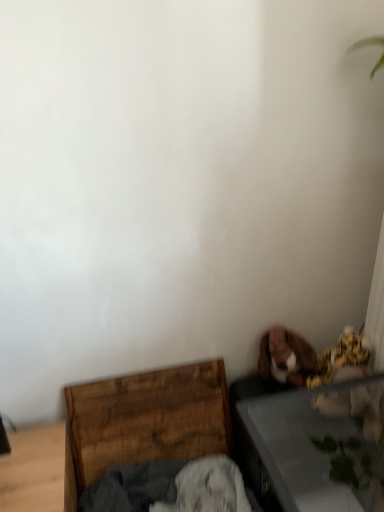
Question: Is dark gray cotton cloth at lower center with transparent glass table at lower right?

Choices:
 (A) no
 (B) yes

Answer: (A)

Question: Can you confirm if dark gray cotton cloth at lower center is smaller than transparent glass table at lower right?

Choices:
 (A) no
 (B) yes

Answer: (B)

Question: Would you say dark gray cotton cloth at lower center is outside transparent glass table at lower right?

Choices:
 (A) no
 (B) yes

Answer: (B)

Question: Are dark gray cotton cloth at lower center and transparent glass table at lower right located far from each other?

Choices:
 (A) yes
 (B) no

Answer: (B)

Question: From a real-world perspective, is dark gray cotton cloth at lower center on top of transparent glass table at lower right?

Choices:
 (A) yes
 (B) no

Answer: (B)

Question: From their relative heights in the image, would you say brown plush dog at lower right is taller or shorter than dark gray cotton cloth at lower center?

Choices:
 (A) tall
 (B) short

Answer: (A)

Question: Based on their positions, is brown plush dog at lower right located to the left or right of dark gray cotton cloth at lower center?

Choices:
 (A) right
 (B) left

Answer: (A)

Question: Does point (286, 381) appear closer or farther from the camera than point (216, 457)?

Choices:
 (A) closer
 (B) farther

Answer: (A)

Question: Is brown plush dog at lower right bigger or smaller than dark gray cotton cloth at lower center?

Choices:
 (A) small
 (B) big

Answer: (A)

Question: From a real-world perspective, relative to dark gray cotton cloth at lower center, is wooden chest at lower left vertically above or below?

Choices:
 (A) above
 (B) below

Answer: (A)

Question: From the image's perspective, is wooden chest at lower left above or below dark gray cotton cloth at lower center?

Choices:
 (A) above
 (B) below

Answer: (A)

Question: Considering the positions of wooden chest at lower left and dark gray cotton cloth at lower center in the image, is wooden chest at lower left bigger or smaller than dark gray cotton cloth at lower center?

Choices:
 (A) small
 (B) big

Answer: (B)

Question: In terms of width, does wooden chest at lower left look wider or thinner when compared to dark gray cotton cloth at lower center?

Choices:
 (A) wide
 (B) thin

Answer: (B)

Question: Considering their positions, is transparent glass table at lower right located in front of or behind dark gray cotton cloth at lower center?

Choices:
 (A) behind
 (B) front

Answer: (B)

Question: From a real-world perspective, is transparent glass table at lower right physically located above or below dark gray cotton cloth at lower center?

Choices:
 (A) below
 (B) above

Answer: (B)